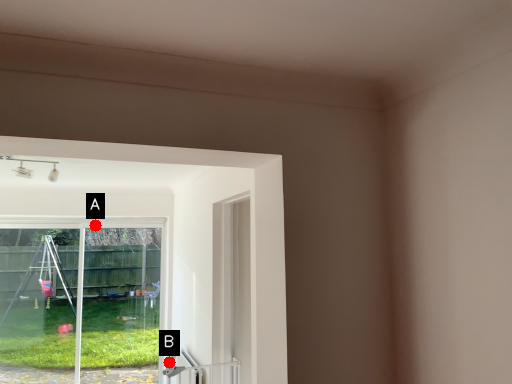
Question: Two points are circled on the image, labeled by A and B beside each circle. Which point is further to the camera?

Choices:
 (A) A is further
 (B) B is further

Answer: (B)